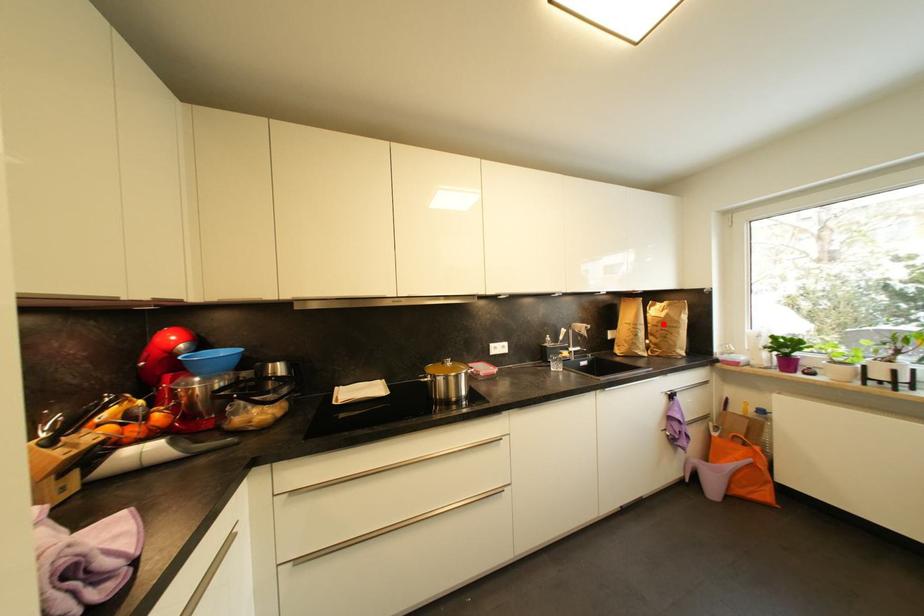
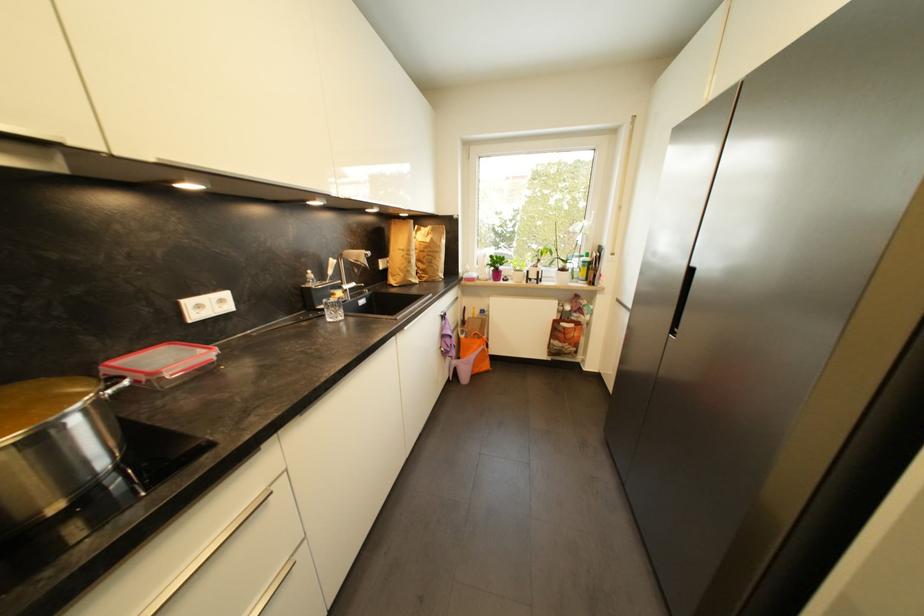
Question: I am providing you with two images of the same scene from different viewpoints. In image1, a red point is highlighted. Considering the same 3D point in image2, which of the following is correct?

Choices:
 (A) It is closer
 (B) It is farther

Answer: (A)